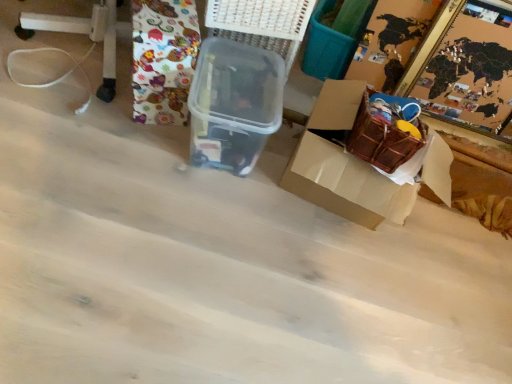
The image size is (512, 384). Identify the location of vacant space to the left of brown cardboard box at lower right. (225, 184).